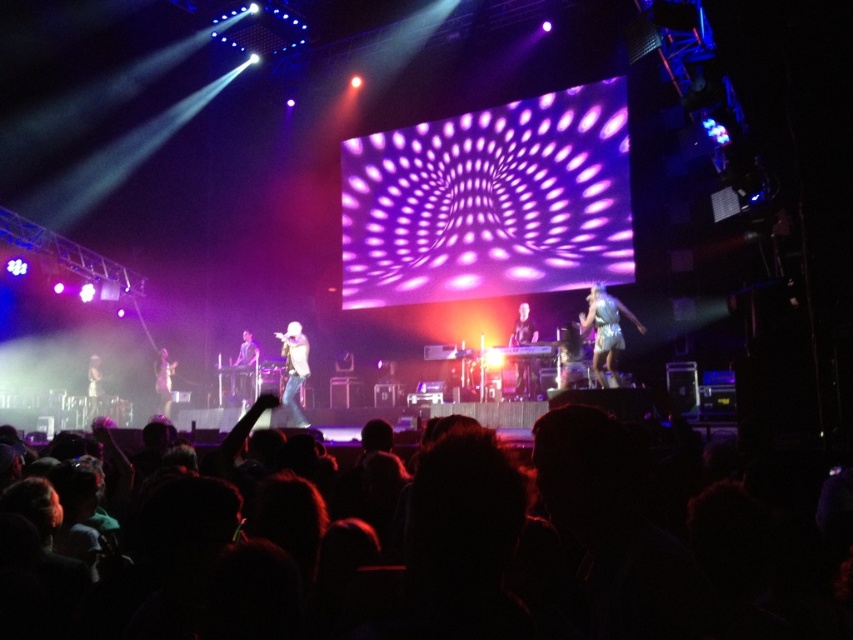
You are a concert attendee sitting in the front row. You want to take a photo of the shiny silver keyboard at center with your phone. Considering the distance between you and the keyboard, is it possible to capture the entire keyboard in your photo without zooming in?

The shiny silver keyboard at center is 11.08 meters away from you. Since the keyboard is at a considerable distance, capturing its entire image without zooming might be challenging due to the phone camera sensor limitations. However, if your phone has a wide angle lens or you position yourself appropriately, it could be possible. But based on standard phone camera capabilities, it might require slight zooming to frame it properly.

You are a photographer at the concert. You want to capture a photo where the white sparkly dress at right and the shiny silver keyboard at center are both visible. Based on their sizes, which object should you frame first to ensure both fit in the shot?

The white sparkly dress at right is wider than the shiny silver keyboard at center. To ensure both fit in the shot, you should frame the wider object first, which is the white sparkly dress at right.